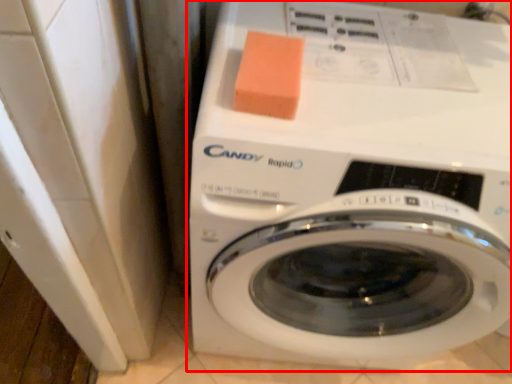
Question: From the image's perspective, what is the correct spatial relationship of washing machine (annotated by the red box) in relation to soap?

Choices:
 (A) above
 (B) below

Answer: (B)